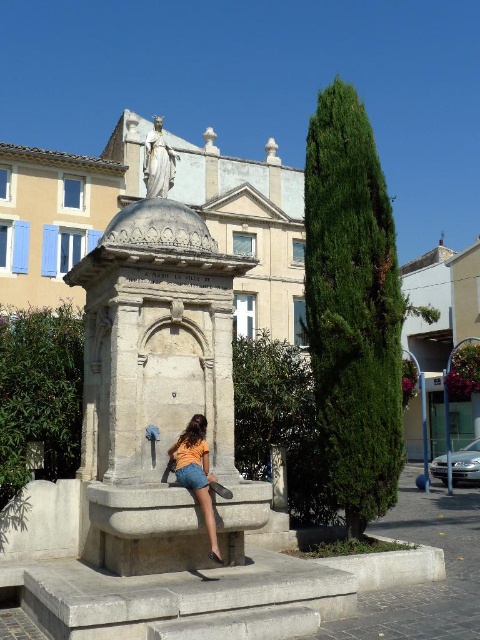
Question: Is orange cotton shirt at center thinner than white marble statue at upper center?

Choices:
 (A) no
 (B) yes

Answer: (B)

Question: Which point is farther to the camera?

Choices:
 (A) white marble statue at upper center
 (B) orange cotton shirt at center

Answer: (A)

Question: Is orange cotton shirt at center bigger than white marble statue at upper center?

Choices:
 (A) no
 (B) yes

Answer: (A)

Question: Which of the following is the farthest from the observer?

Choices:
 (A) white marble statue at upper center
 (B) orange cotton shirt at center

Answer: (A)

Question: Which point appears farthest from the camera in this image?

Choices:
 (A) (188, 433)
 (B) (148, 196)

Answer: (B)

Question: Is orange cotton shirt at center further to the viewer compared to white marble statue at upper center?

Choices:
 (A) yes
 (B) no

Answer: (B)